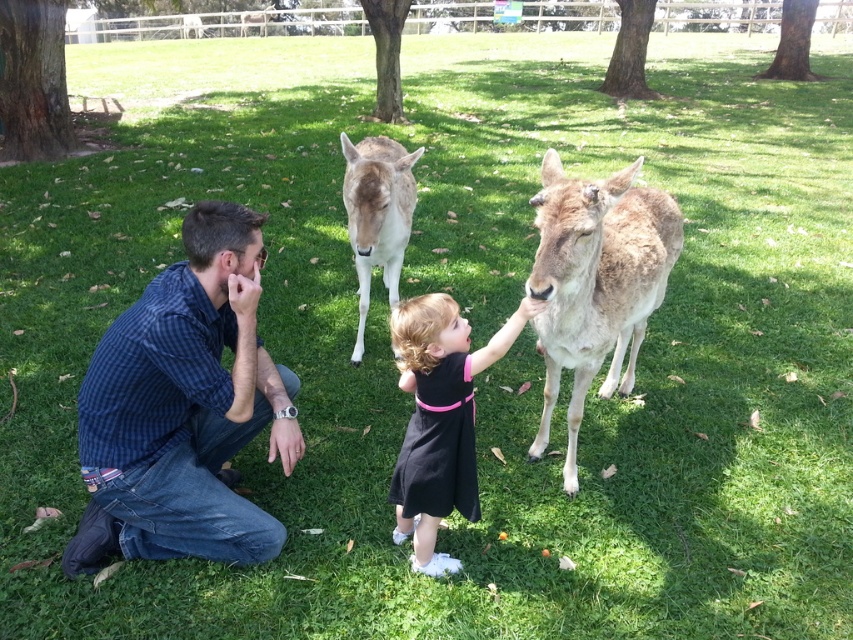
You are a photographer trying to capture a photo of the light brown fur at center without including the blue checkered shirt at left in the frame. Based on their positions, can you do this?

The blue checkered shirt at left is positioned under the light brown fur at center, so it would be possible to frame the shot so that the light brown fur at center is visible while the blue checkered shirt at left is out of the frame.

You are a photographer trying to capture a photo of the blue checkered shirt at left and the light brown fur at center. Which object should you focus on first if you want to ensure both are in frame without moving the camera?

The blue checkered shirt at left should be focused on first because its width is larger than the light brown fur at center, so it will require more space in the frame.